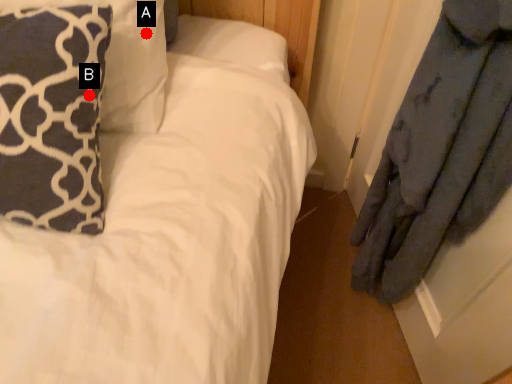
Question: Two points are circled on the image, labeled by A and B beside each circle. Which of the following is the closest to the observer?

Choices:
 (A) A is closer
 (B) B is closer

Answer: (B)